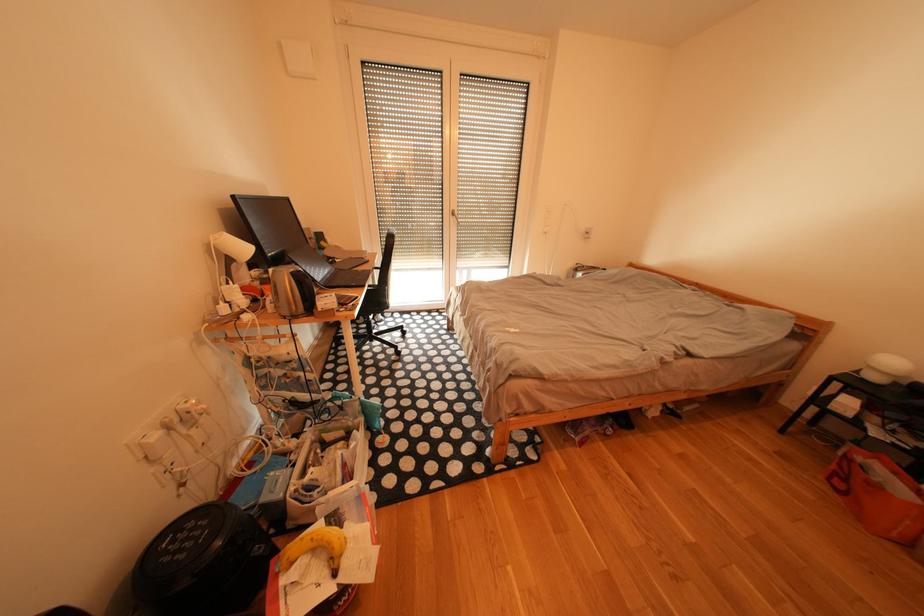
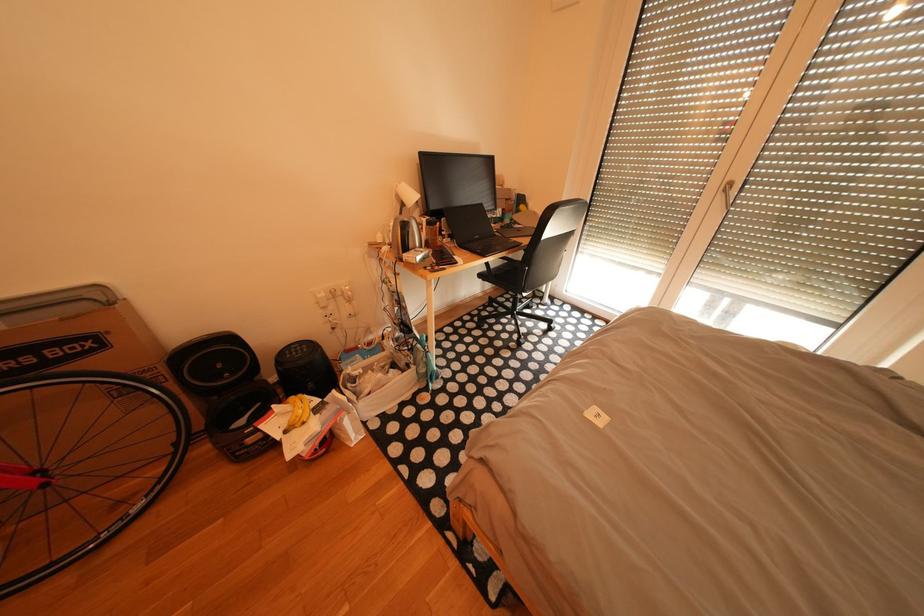
How did the camera likely rotate?

The camera rotated toward left-down.